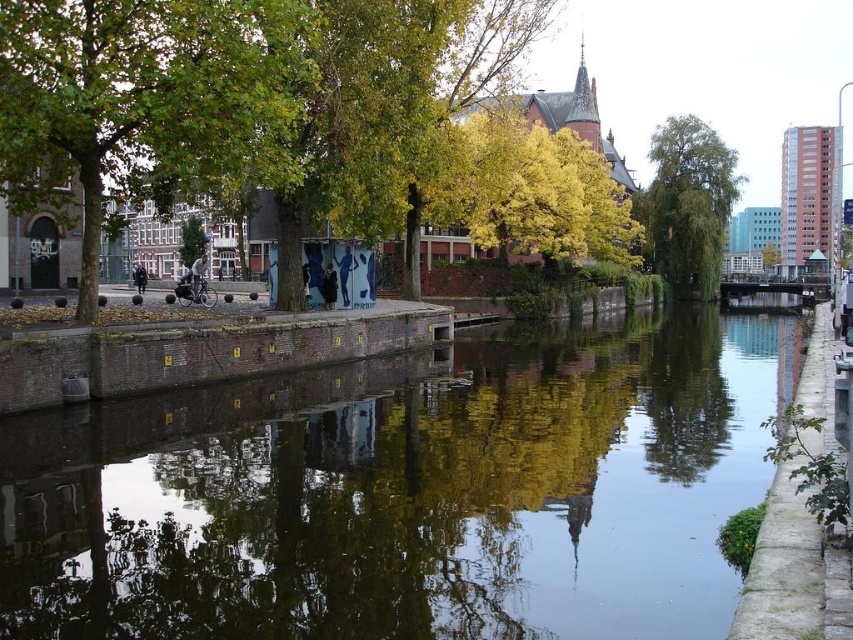
You are standing on the paved walkway next to the green leafy tree at left. You want to walk straight ahead towards the green matte tree at center. Will you have to walk uphill or downhill?

The green leafy tree at left is closer to the viewer than the green matte tree at center, so walking towards the green matte tree at center means you are moving away from the viewer. Since the scene shows a canal with calm water and trees lining it, the terrain is likely flat. Therefore, you will not have to walk uphill or downhill.

You are a tourist standing on the walkway by the canal and want to take a photo of both the smooth concrete canal at center and the green matte tree at center. Which object should you focus on first if you want to capture both in the same frame without moving your camera?

The smooth concrete canal at center is not as tall as the green matte tree at center, so you should focus on the green matte tree at center first to ensure both are in the frame.